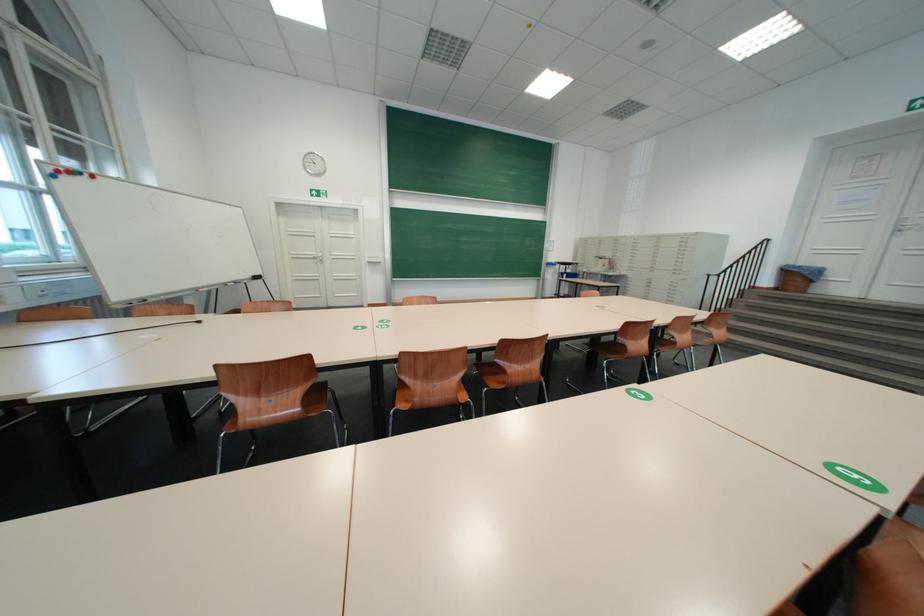
The location [798,277] corresponds to which object?

This point indicates the wicker trash can.